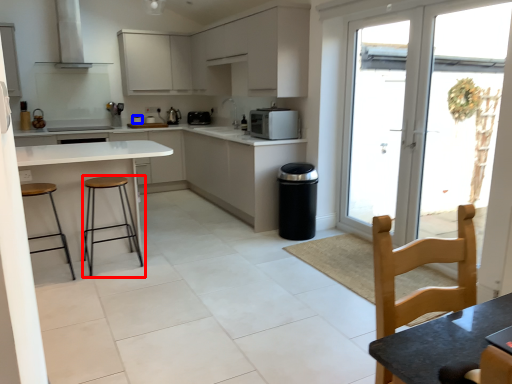
Question: Which of the following is the closest to the observer, stool (highlighted by a red box) or appliance (highlighted by a blue box)?

Choices:
 (A) stool
 (B) appliance

Answer: (A)